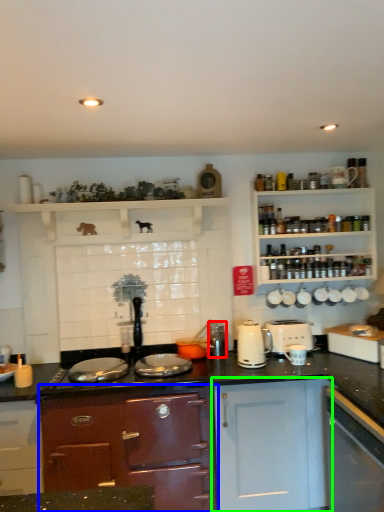
Question: Estimate the real-world distances between objects in this image. Which object is closer to appliance (highlighted by a red box), cabinetry (highlighted by a blue box) or cabinetry (highlighted by a green box)?

Choices:
 (A) cabinetry
 (B) cabinetry

Answer: (B)